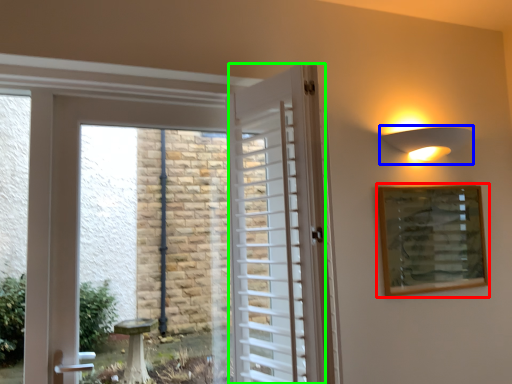
Question: Which is nearer to the picture frame (highlighted by a red box)? light fixture (highlighted by a blue box) or door (highlighted by a green box).

Choices:
 (A) light fixture
 (B) door

Answer: (A)